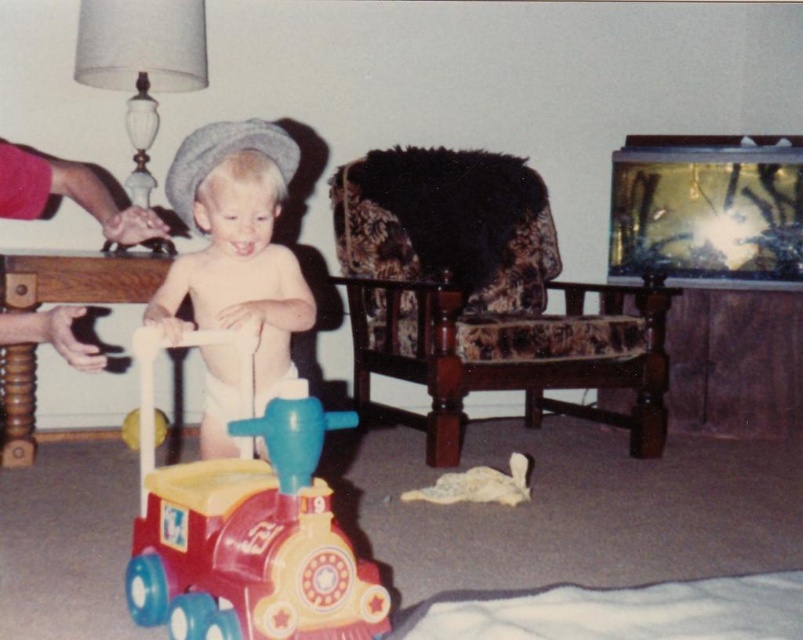
Question: Does plastic train at center have a lesser width compared to smooth beige baby walker at center?

Choices:
 (A) yes
 (B) no

Answer: (B)

Question: Is plastic train at center positioned behind smooth beige baby walker at center?

Choices:
 (A) no
 (B) yes

Answer: (A)

Question: Which point is farther to the camera?

Choices:
 (A) (237, 304)
 (B) (214, 596)

Answer: (A)

Question: Can you confirm if plastic train at center is smaller than smooth beige baby walker at center?

Choices:
 (A) no
 (B) yes

Answer: (B)

Question: Which point is closer to the camera taking this photo?

Choices:
 (A) (265, 490)
 (B) (225, 200)

Answer: (A)

Question: Which point is farther to the camera?

Choices:
 (A) plastic train at center
 (B) smooth beige baby walker at center

Answer: (B)